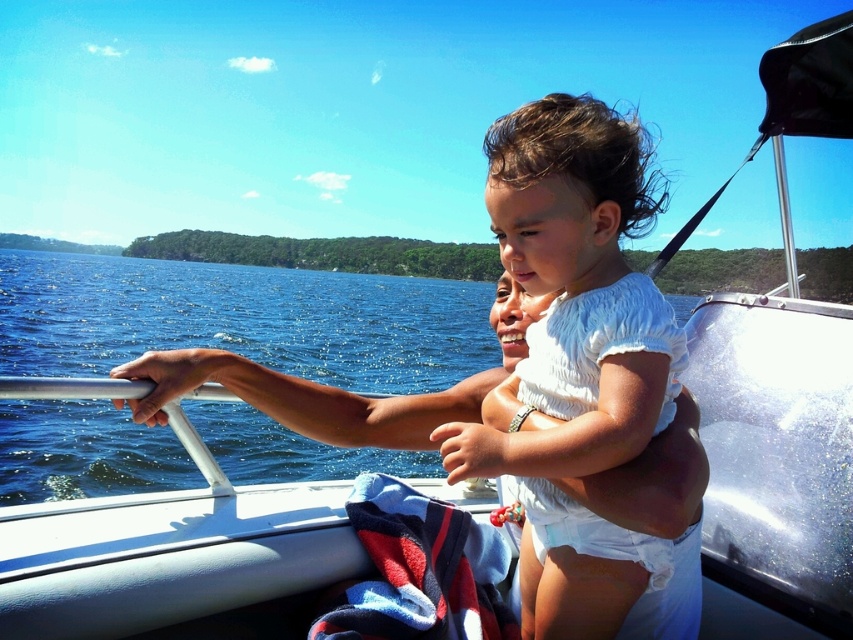
Looking at this image, you are a photographer on the boat and want to capture a photo where the blue water at left and the white cotton toddler at center are both visible. Which object should you focus on to ensure both are in the frame?

Since the blue water at left is larger in size than the white cotton toddler at center, you should focus on the blue water at left to ensure both are in the frame as it occupies more space.